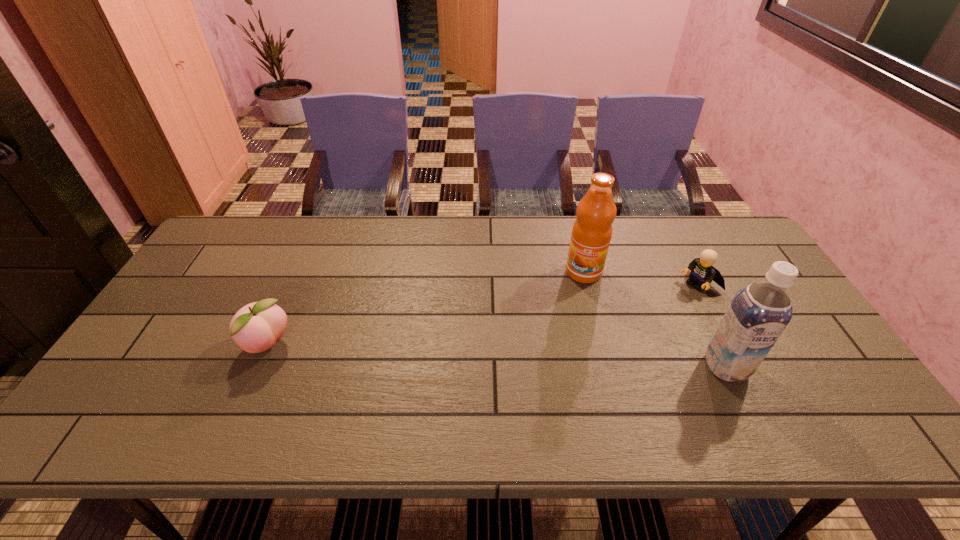
This screenshot has width=960, height=540. What are the coordinates of `free space located 0.370m on the label side of the second object from left to right` in the screenshot? It's located at (540, 380).

Identify the location of object located at the far edge. (591, 234).

The height and width of the screenshot is (540, 960). Find the location of `object situated at the near edge`. object situated at the near edge is located at coordinates (758, 314).

In the image, there is a desktop. At what (x,y) coordinates should I click in order to perform the action: click on vacant space at the far edge. Please return your answer as a coordinate pair (x, y). Image resolution: width=960 pixels, height=540 pixels. Looking at the image, I should click on (524, 225).

Where is `vacant space at the near edge of the desktop`? The width and height of the screenshot is (960, 540). vacant space at the near edge of the desktop is located at coordinates (441, 391).

Locate an element on the screen. The width and height of the screenshot is (960, 540). vacant space at the right edge of the desktop is located at coordinates (726, 270).

This screenshot has height=540, width=960. What are the coordinates of `vacant space at the far left corner` in the screenshot? It's located at (224, 251).

The image size is (960, 540). I want to click on vacant area that lies between the fruit juice and the Lego, so click(640, 278).

Image resolution: width=960 pixels, height=540 pixels. Identify the location of vacant space that's between the Lego and the soya milk. (712, 325).

In order to click on free space between the soya milk and the leftmost object in this screenshot , I will do click(x=497, y=356).